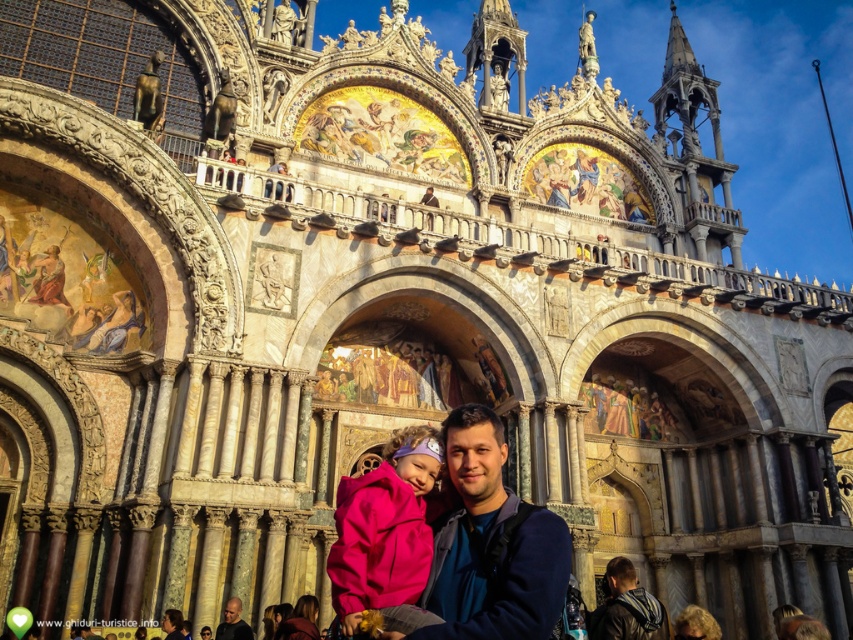
Question: Which point appears farthest from the camera in this image?

Choices:
 (A) (389, 602)
 (B) (248, 632)

Answer: (B)

Question: Which point appears closest to the camera in this image?

Choices:
 (A) (512, 605)
 (B) (305, 632)

Answer: (A)

Question: Observing the image, what is the correct spatial positioning of matte pink coat at center in reference to matte black jacket at lower center?

Choices:
 (A) below
 (B) above

Answer: (B)

Question: Can you confirm if matte pink coat at center is smaller than matte black jacket at lower center?

Choices:
 (A) yes
 (B) no

Answer: (A)

Question: Which object appears closest to the camera in this image?

Choices:
 (A) leather jacket at lower center
 (B) matte black jacket at lower center

Answer: (A)

Question: Does matte black jacket at lower center have a smaller size compared to matte pink jacket at lower center?

Choices:
 (A) yes
 (B) no

Answer: (B)